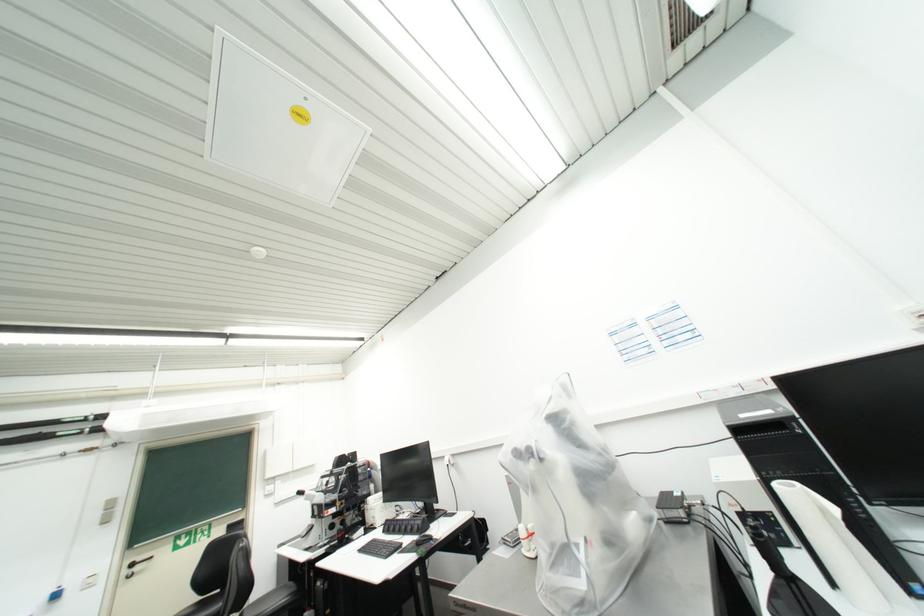
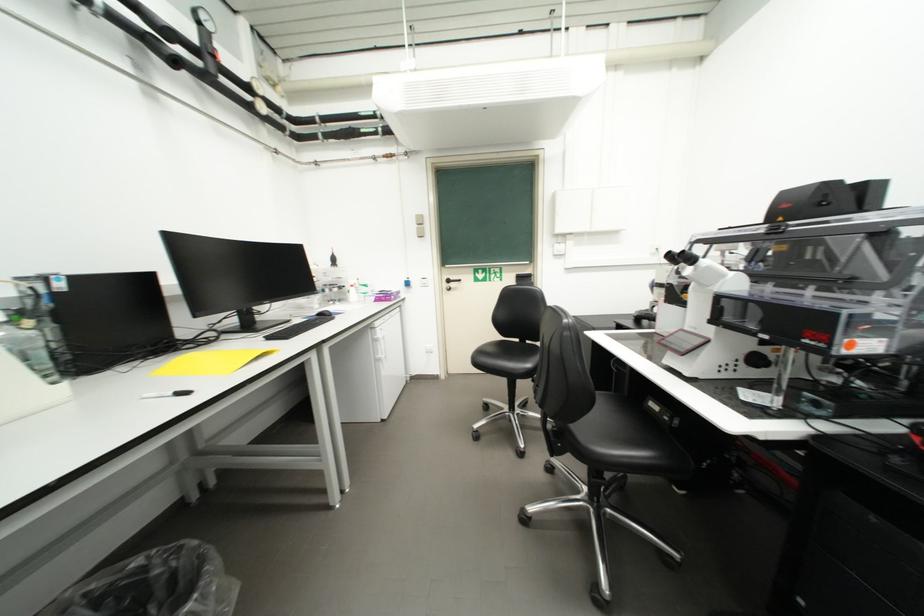
In the second image, find the point that corresponds to (140,565) in the first image.

(456, 283)